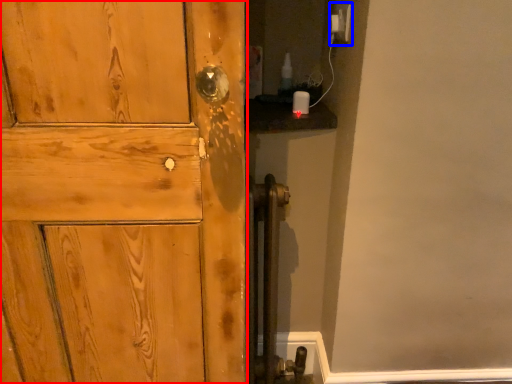
Question: Which point is closer to the camera, door (highlighted by a red box) or electric outlet (highlighted by a blue box)?

Choices:
 (A) door
 (B) electric outlet

Answer: (A)